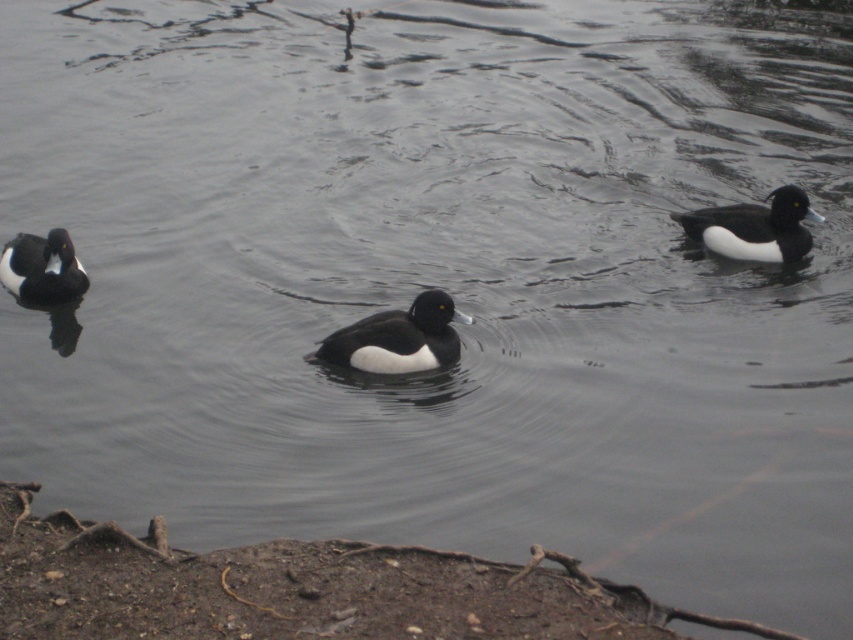
Question: Is white matte duck at right to the left of white-feathered duck at left from the viewer's perspective?

Choices:
 (A) no
 (B) yes

Answer: (A)

Question: Is black glossy duck at center positioned before white matte duck at right?

Choices:
 (A) no
 (B) yes

Answer: (B)

Question: Which of the following is the closest to the observer?

Choices:
 (A) white-feathered duck at left
 (B) white matte duck at right

Answer: (A)

Question: Among these objects, which one is nearest to the camera?

Choices:
 (A) black glossy duck at center
 (B) white-feathered duck at left

Answer: (A)

Question: Which point appears closest to the camera in this image?

Choices:
 (A) (74, 256)
 (B) (422, 333)
 (C) (735, 218)

Answer: (B)

Question: Can you confirm if black glossy duck at center is thinner than white-feathered duck at left?

Choices:
 (A) no
 (B) yes

Answer: (A)